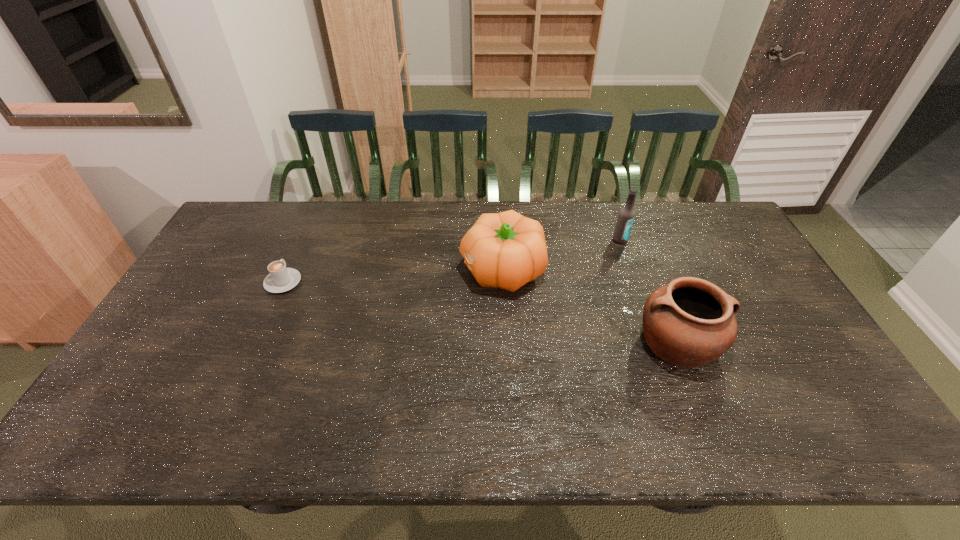
The image size is (960, 540). What are the coordinates of `free point between the second object from left to right and the beer bottle` in the screenshot? It's located at (561, 255).

Locate an element on the screen. Image resolution: width=960 pixels, height=540 pixels. object that can be found as the second closest to the cappuccino is located at coordinates (690, 322).

Identify which object is the nearest to the beer bottle. Please provide its 2D coordinates. Your answer should be formatted as a tuple, i.e. [(x, y)], where the tuple contains the x and y coordinates of a point satisfying the conditions above.

[(506, 250)]

Locate an element on the screen. This screenshot has width=960, height=540. free location that satisfies the following two spatial constraints: 1. on the carved face of the second shortest object; 2. on the right side of the pumpkin is located at coordinates (506, 342).

At what (x,y) coordinates should I click in order to perform the action: click on vacant space that satisfies the following two spatial constraints: 1. on the label of the beer bottle; 2. on the carved face of the second object from left to right. Please return your answer as a coordinate pair (x, y). Looking at the image, I should click on [x=631, y=270].

Locate an element on the screen. Image resolution: width=960 pixels, height=540 pixels. free point that satisfies the following two spatial constraints: 1. on the carved face of the second shortest object; 2. on the left side of the third object from right to left is located at coordinates (506, 342).

At what (x,y) coordinates should I click in order to perform the action: click on vacant region that satisfies the following two spatial constraints: 1. on the label of the beer bottle; 2. on the carved face of the pumpkin. Please return your answer as a coordinate pair (x, y). Looking at the image, I should click on (631, 270).

Locate an element on the screen. This screenshot has height=540, width=960. vacant position in the image that satisfies the following two spatial constraints: 1. on the label of the beer bottle; 2. on the right side of the nearest object is located at coordinates (657, 342).

Find the location of `vacant region that satisfies the following two spatial constraints: 1. on the label of the beer bottle; 2. on the carved face of the pumpkin`. vacant region that satisfies the following two spatial constraints: 1. on the label of the beer bottle; 2. on the carved face of the pumpkin is located at coordinates (631, 270).